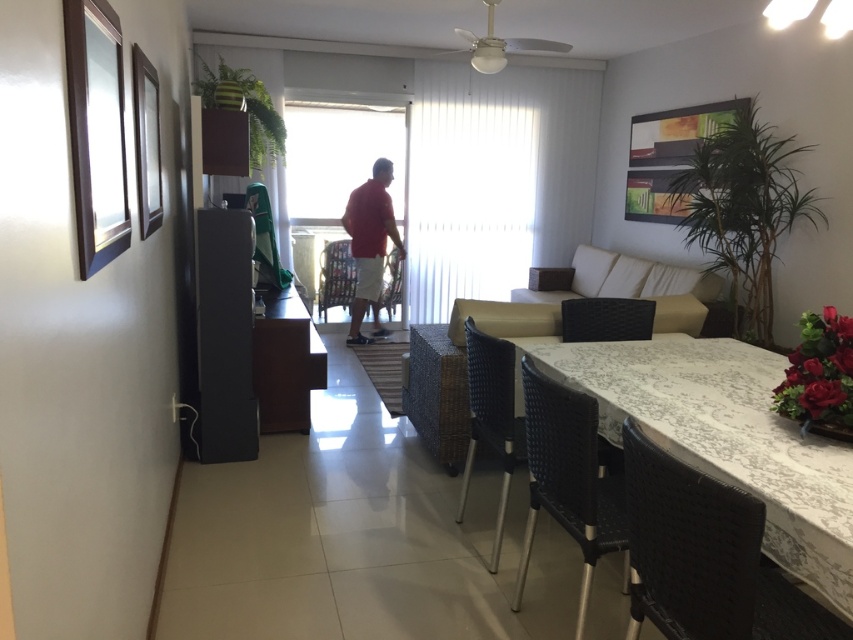
Which is more to the right, woven black chair at center or matte black chair at center?

woven black chair at center

Who is shorter, woven black chair at center or matte black chair at center?

matte black chair at center

Which is in front, point (492, 337) or point (390, 291)?

Point (492, 337) is in front.

Identify the location of woven black chair at center. This screenshot has width=853, height=640. point(491,417).

Which is above, woven black chair at center or red matte shirt at center?

red matte shirt at center is higher up.

Which of these two, woven black chair at center or red matte shirt at center, stands shorter?

With less height is woven black chair at center.

Is point (485, 378) closer to camera compared to point (379, 291)?

Yes, point (485, 378) is closer to viewer.

The height and width of the screenshot is (640, 853). Find the location of `woven black chair at center`. woven black chair at center is located at coordinates (491, 417).

Does black woven chair at lower right have a lesser height compared to matte plastic chair at center?

In fact, black woven chair at lower right may be taller than matte plastic chair at center.

Locate an element on the screen. This screenshot has width=853, height=640. black woven chair at lower right is located at coordinates (572, 480).

In order to click on black woven chair at lower right in this screenshot , I will do `click(572, 480)`.